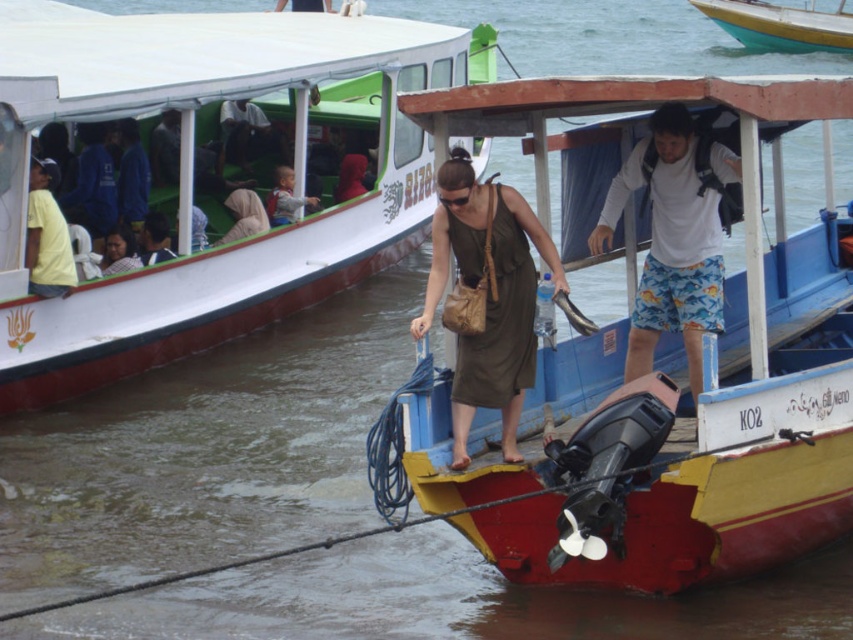
You are a passenger on the red painted wood boat at center and want to move to the blue fabric shirt at left. Based on their positions, which direction should you go to reach it?

The red painted wood boat at center is positioned on the right side of the blue fabric shirt at left, so you should go to the left to reach it.

You are a dock worker who needs to secure both the wooden boat at center and the teal glossy boat at upper center with a 10 meters long rope. Considering their sizes, will the rope be sufficient to tie both boats together?

The wooden boat at center is wider than the teal glossy boat at upper center, so the 10 meters rope is sufficient to tie both boats together since the length can accommodate their widths.

You are standing on the dock and see the red painted wood boat at center and the blue fabric shirt at left. Which object is positioned lower in the scene?

The red painted wood boat at center is positioned below the blue fabric shirt at left, so it is lower in the scene.